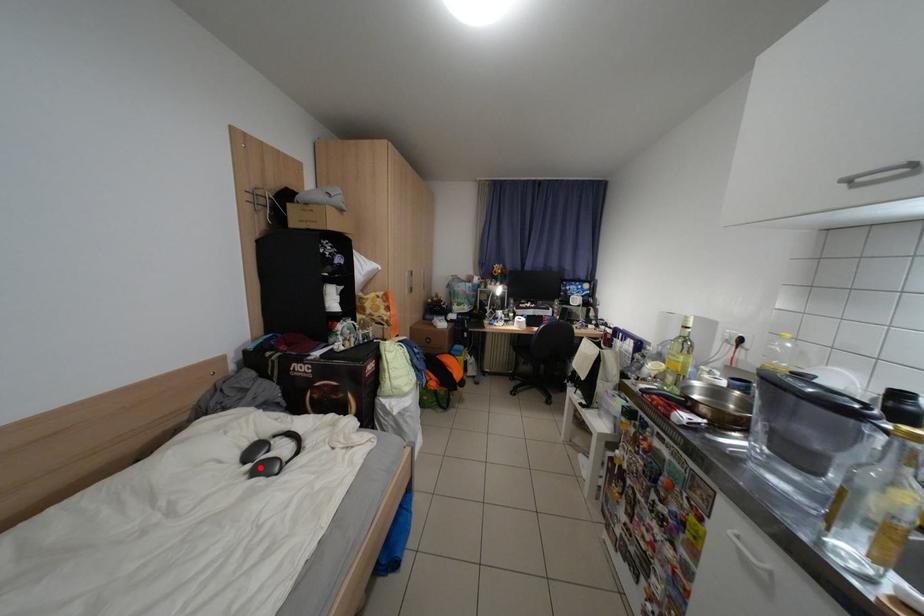
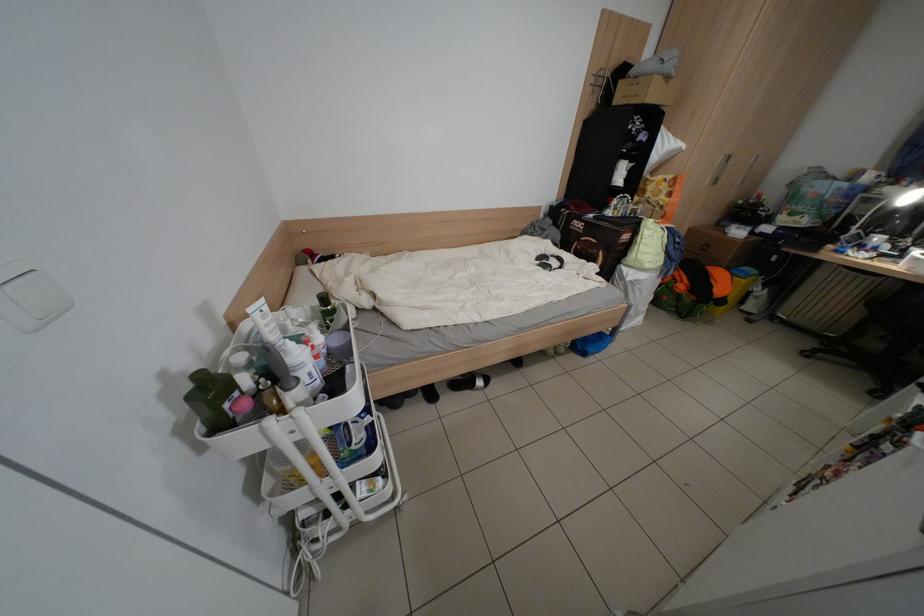
Find the pixel in the second image that matches the highlighted location in the first image.

(550, 264)